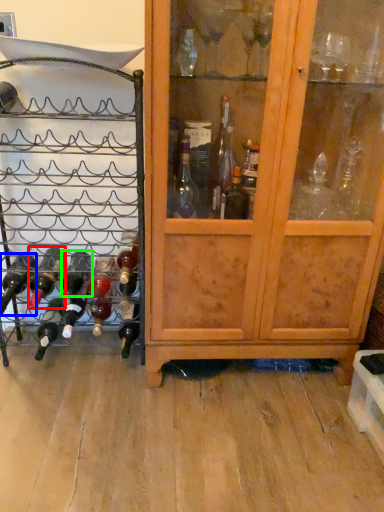
Question: Estimate the real-world distances between objects in this image. Which object is farther from bottle (highlighted by a red box), bottle (highlighted by a blue box) or bottle (highlighted by a green box)?

Choices:
 (A) bottle
 (B) bottle

Answer: (B)